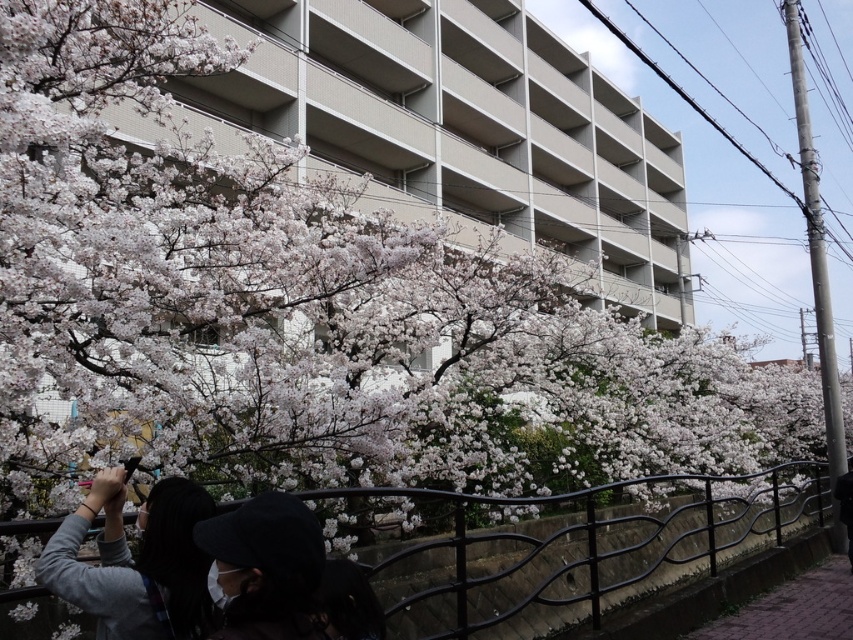
You are a photographer standing at the scene. You want to take a photo of the cherry blossoms without any obstructions. The black metal fence at lower center and the gray fabric jacket at lower left are in your way. Which object should you move out of the way first to get a clear shot?

The black metal fence at lower center is much taller than the gray fabric jacket at lower left. To get a clear shot of the cherry blossoms without obstructions, you should first move the black metal fence at lower center out of the way since it is taller and more likely to block the view.

You are standing at the center of the image and want to walk towards the black metal fence at lower center. Which direction should you move to reach it?

Since the black metal fence at lower center is located at point (575, 544) in 2D coordinates, you should move downward and slightly to the right from the center to reach it.